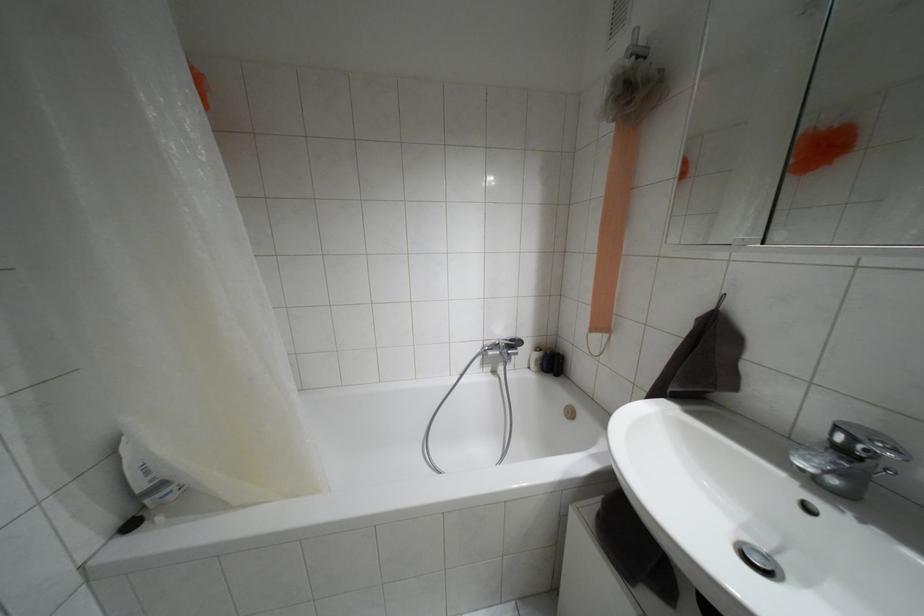
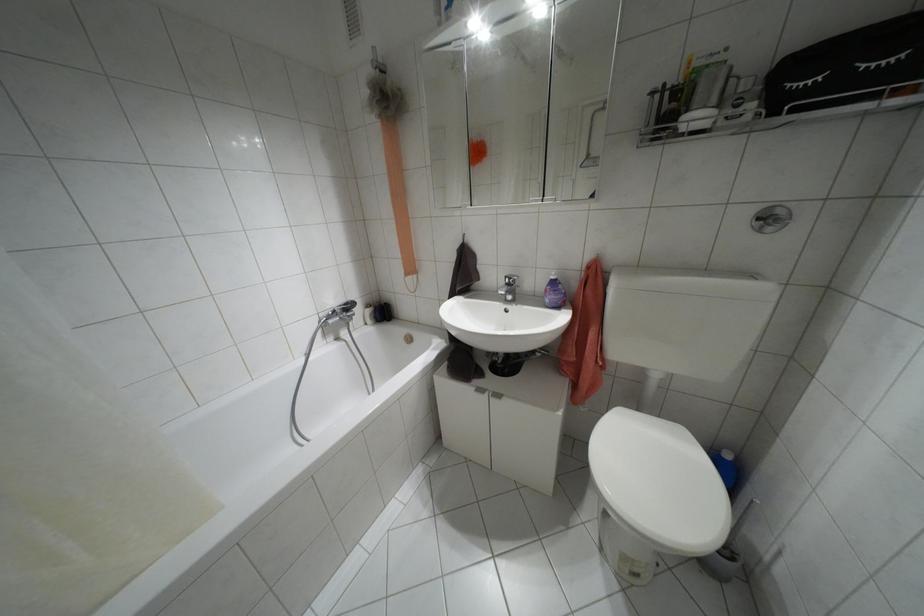
Find the pixel in the second image that matches point 537,347 in the first image.

(367, 305)